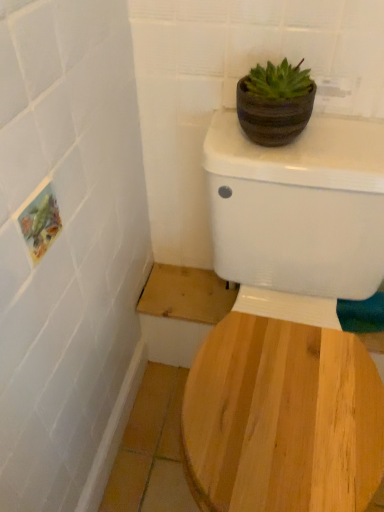
What do you see at coordinates (273, 116) in the screenshot? The height and width of the screenshot is (512, 384). I see `brown striped pot at upper right` at bounding box center [273, 116].

Locate an element on the screen. brown striped pot at upper right is located at coordinates (273, 116).

The width and height of the screenshot is (384, 512). Describe the element at coordinates (290, 324) in the screenshot. I see `white glossy toilet at upper center` at that location.

What is the approximate width of white glossy toilet at upper center?

white glossy toilet at upper center is 28.00 inches in width.

Locate an element on the screen. The image size is (384, 512). white glossy toilet at upper center is located at coordinates pyautogui.click(x=290, y=324).

Measure the distance between white glossy toilet at upper center and camera.

The depth of white glossy toilet at upper center is 26.10 inches.

Locate an element on the screen. The height and width of the screenshot is (512, 384). brown striped pot at upper right is located at coordinates (273, 116).

Considering the positions of objects white glossy toilet at upper center and brown striped pot at upper right in the image provided, who is more to the right, white glossy toilet at upper center or brown striped pot at upper right?

Positioned to the right is white glossy toilet at upper center.

Does white glossy toilet at upper center come behind brown striped pot at upper right?

No, white glossy toilet at upper center is closer to the camera.

Which is nearer, (364, 148) or (292, 115)?

Point (292, 115)

From the image's perspective, is white glossy toilet at upper center under brown striped pot at upper right?

Correct, white glossy toilet at upper center appears lower than brown striped pot at upper right in the image.

From a real-world perspective, does white glossy toilet at upper center sit lower than brown striped pot at upper right?

Correct, in the physical world, white glossy toilet at upper center is lower than brown striped pot at upper right.

Is white glossy toilet at upper center wider or thinner than brown striped pot at upper right?

Clearly, white glossy toilet at upper center has more width compared to brown striped pot at upper right.

In the scene shown: Considering the sizes of white glossy toilet at upper center and brown striped pot at upper right in the image, is white glossy toilet at upper center taller or shorter than brown striped pot at upper right?

Clearly, white glossy toilet at upper center is taller compared to brown striped pot at upper right.

Does white glossy toilet at upper center have a larger size compared to brown striped pot at upper right?

Yes.

Is brown striped pot at upper right completely or partially inside white glossy toilet at upper center?

No, brown striped pot at upper right is not surrounded by white glossy toilet at upper center.

Is white glossy toilet at upper center beside brown striped pot at upper right?

No, white glossy toilet at upper center is not making contact with brown striped pot at upper right.

Is white glossy toilet at upper center positioned with its back to brown striped pot at upper right?

No, brown striped pot at upper right is not at the back of white glossy toilet at upper center.

What's the angular difference between white glossy toilet at upper center and brown striped pot at upper right's facing directions?

0.00352 degrees.

Measure the distance from white glossy toilet at upper center to brown striped pot at upper right.

A distance of 11.06 inches exists between white glossy toilet at upper center and brown striped pot at upper right.

Where is `toilet that appears below the brown striped pot at upper right (from a real-world perspective)`? toilet that appears below the brown striped pot at upper right (from a real-world perspective) is located at coordinates (290, 324).

Which object is positioned more to the left, brown striped pot at upper right or white glossy toilet at upper center?

Positioned to the left is brown striped pot at upper right.

Does brown striped pot at upper right lie in front of white glossy toilet at upper center?

No, brown striped pot at upper right is further to the viewer.

Which is further, (243, 121) or (284, 234)?

Positioned behind is point (284, 234).

From the image's perspective, is brown striped pot at upper right on top of white glossy toilet at upper center?

Yes, from the image's perspective, brown striped pot at upper right is on top of white glossy toilet at upper center.

From a real-world perspective, is brown striped pot at upper right located higher than white glossy toilet at upper center?

Correct, in the physical world, brown striped pot at upper right is higher than white glossy toilet at upper center.

Can you confirm if brown striped pot at upper right is thinner than white glossy toilet at upper center?

Indeed, brown striped pot at upper right has a lesser width compared to white glossy toilet at upper center.

In terms of height, does brown striped pot at upper right look taller or shorter compared to white glossy toilet at upper center?

Considering their sizes, brown striped pot at upper right has less height than white glossy toilet at upper center.

Is brown striped pot at upper right bigger than white glossy toilet at upper center?

No, brown striped pot at upper right is not bigger than white glossy toilet at upper center.

Is brown striped pot at upper right situated inside white glossy toilet at upper center or outside?

The correct answer is: outside.

Does brown striped pot at upper right touch white glossy toilet at upper center?

brown striped pot at upper right and white glossy toilet at upper center are not in contact.

Is white glossy toilet at upper center at the back of brown striped pot at upper right?

brown striped pot at upper right is not turned away from white glossy toilet at upper center.

Locate an element on the screen. This screenshot has height=512, width=384. toilet on the right of brown striped pot at upper right is located at coordinates (290, 324).

The width and height of the screenshot is (384, 512). Identify the location of toilet that appears in front of the brown striped pot at upper right. (290, 324).

This screenshot has width=384, height=512. I want to click on flowerpot on the left of white glossy toilet at upper center, so click(273, 116).